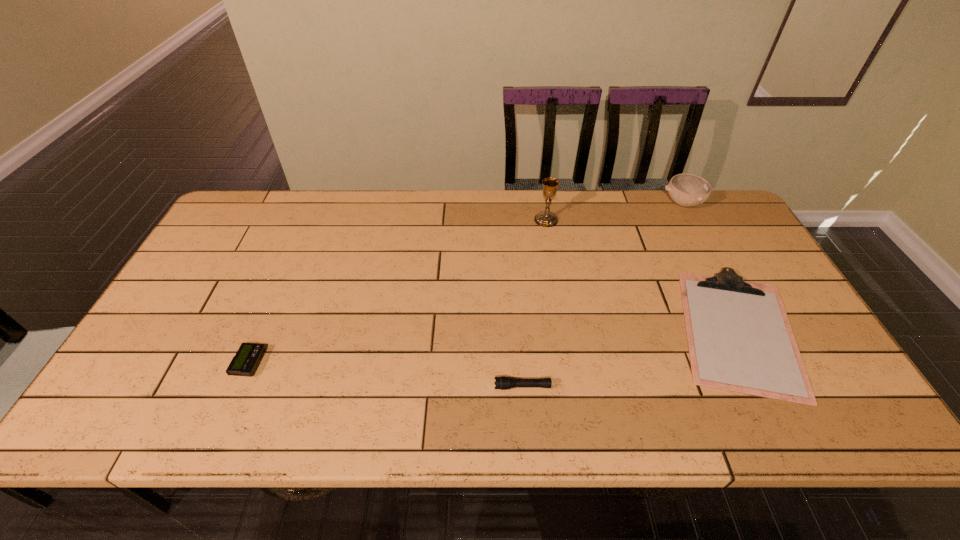
This screenshot has height=540, width=960. What are the coordinates of `vacant point that satisfies the following two spatial constraints: 1. on the back side of the leftmost object; 2. on the left side of the clipboard` in the screenshot? It's located at (263, 331).